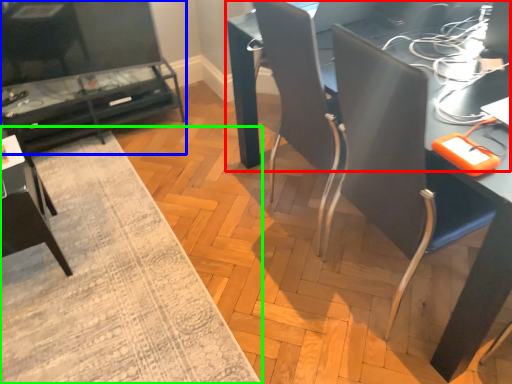
Question: Based on their relative distances, which object is farther from table (highlighted by a red box)? Choose from table (highlighted by a blue box) and mat (highlighted by a green box).

Choices:
 (A) table
 (B) mat

Answer: (A)